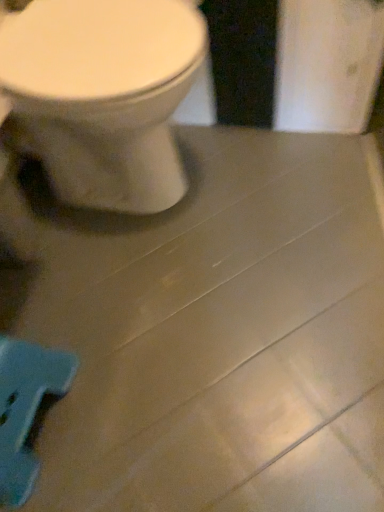
Image resolution: width=384 pixels, height=512 pixels. What are the coordinates of `vacant space to the right of blue plastic toy at lower left` in the screenshot? It's located at (124, 392).